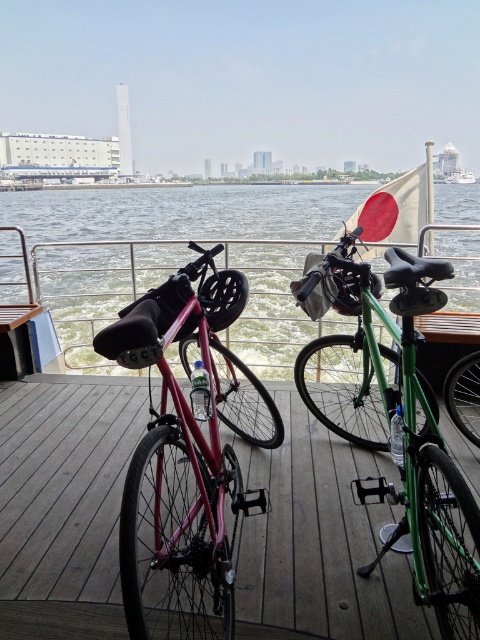
You are standing at the point marked by coordinates point [66,499] on the ferry deck. Looking around, you see the matte black bicycle at center. What object is located exactly at your current position?

The point [66,499] marks the location of the matte black bicycle at center.

You are standing on the ferry deck and want to take a photo of both the pink bicycle and the green bicycle. The pink bicycle is located at point (x=99, y=400) and the green bicycle is at point (x=442, y=490). Since you want both in focus, which bicycle should you focus on first to ensure both are clear?

You should focus on the pink bicycle at point (x=99, y=400) first because it is closer to the camera than the green bicycle at point (x=442, y=490). This way, both bicycles will be in focus.

You are a passenger on the ferry and want to take a photo of both the matte black bicycle at center and the green matte bicycle at center. Since you only have space for one bicycle in your camera frame, which bicycle should you position closer to the left side of your camera to include both in the photo?

You should position the matte black bicycle at center closer to the left side of your camera frame because it is already to the left of the green matte bicycle at center, allowing both to fit within the frame.